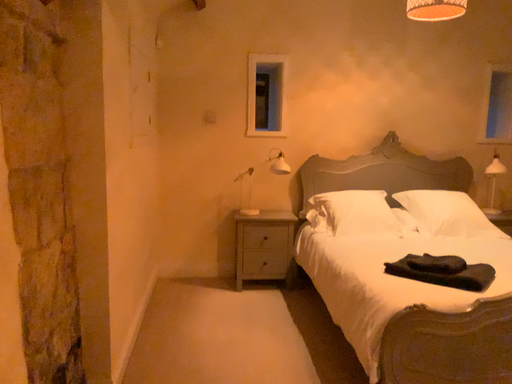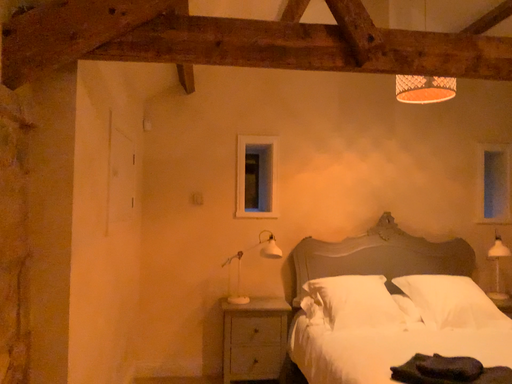
Question: How did the camera likely rotate when shooting the video?

Choices:
 (A) rotated upward
 (B) rotated downward

Answer: (A)